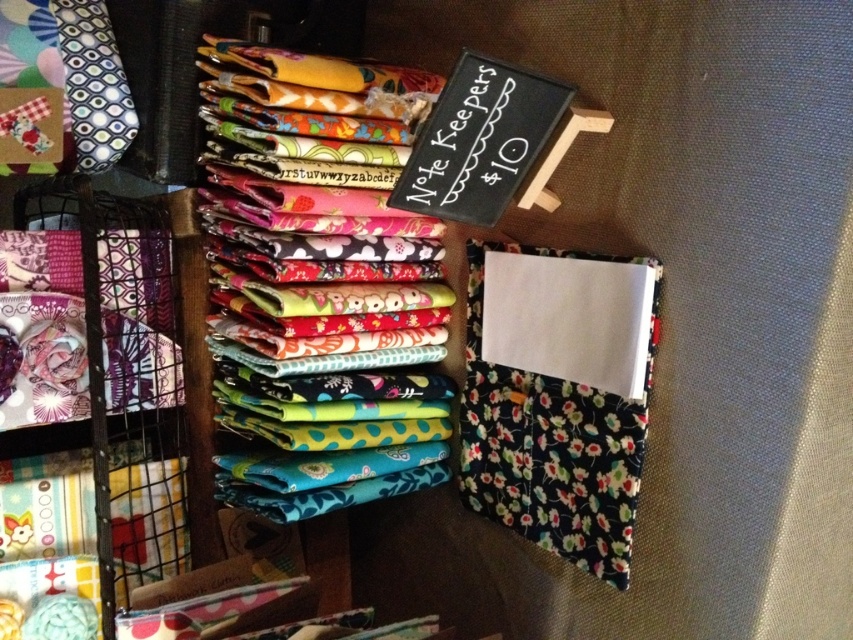
Question: Which object appears farthest from the camera in this image?

Choices:
 (A) black chalkboard at upper center
 (B) vibrant printed fabric at center
 (C) patterned fabric tie at upper left

Answer: (C)

Question: Where is vibrant printed fabric at center located in relation to black chalkboard at upper center in the image?

Choices:
 (A) above
 (B) below

Answer: (B)

Question: Can you confirm if vibrant printed fabric at center is smaller than patterned fabric tie at upper left?

Choices:
 (A) no
 (B) yes

Answer: (A)

Question: Which object is the farthest from the vibrant printed fabric at center?

Choices:
 (A) patterned fabric tie at upper left
 (B) black chalkboard at upper center

Answer: (A)

Question: Can you confirm if vibrant printed fabric at center is wider than patterned fabric tie at upper left?

Choices:
 (A) yes
 (B) no

Answer: (A)

Question: Which is nearer to the patterned fabric tie at upper left?

Choices:
 (A) black chalkboard at upper center
 (B) vibrant printed fabric at center

Answer: (B)